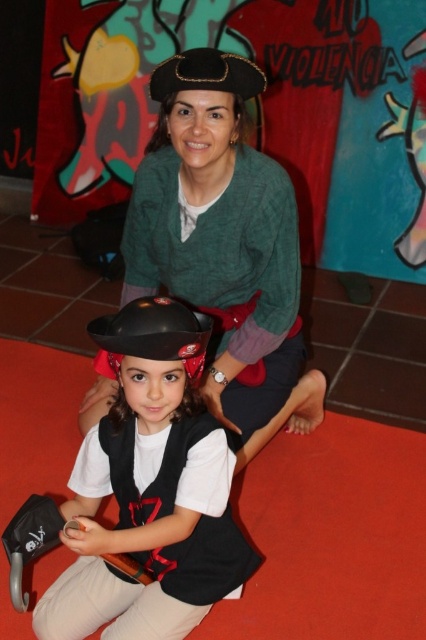
Question: Can you confirm if matte green sweater at center is wider than shiny black helmet at lower left?

Choices:
 (A) no
 (B) yes

Answer: (B)

Question: Which point is farther to the camera?

Choices:
 (A) shiny black helmet at lower left
 (B) matte green sweater at center

Answer: (B)

Question: Does matte green sweater at center have a larger size compared to shiny black helmet at lower left?

Choices:
 (A) yes
 (B) no

Answer: (A)

Question: Is matte green sweater at center bigger than shiny black helmet at lower left?

Choices:
 (A) no
 (B) yes

Answer: (B)

Question: Which point is farther to the camera?

Choices:
 (A) (230, 163)
 (B) (181, 634)

Answer: (A)